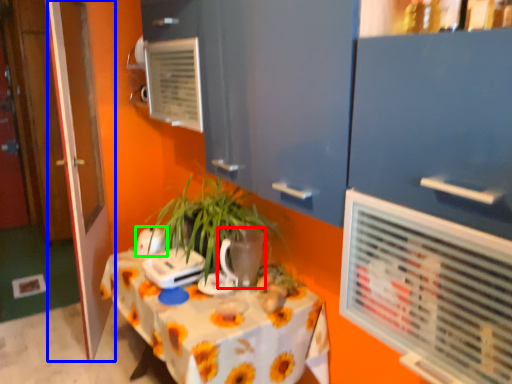
Question: Estimate the real-world distances between objects in this image. Which object is closer to flowerpot (highlighted by a red box), door (highlighted by a blue box) or appliance (highlighted by a green box)?

Choices:
 (A) door
 (B) appliance

Answer: (B)